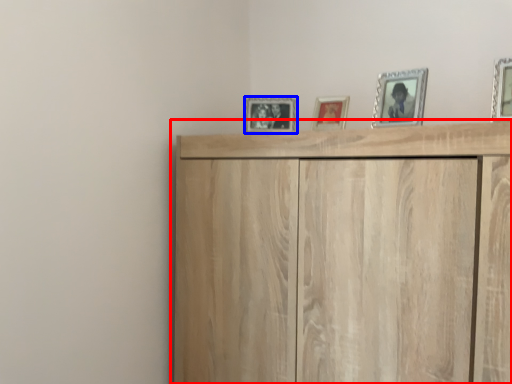
Question: Which of the following is the closest to the observer, cupboard (highlighted by a red box) or picture frame (highlighted by a blue box)?

Choices:
 (A) cupboard
 (B) picture frame

Answer: (A)